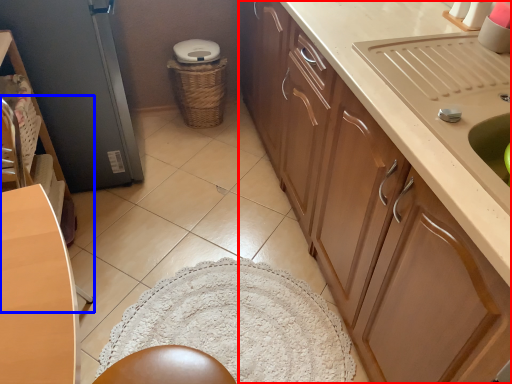
Question: Which object appears farthest to the camera in this image, cabinetry (highlighted by a red box) or chair (highlighted by a blue box)?

Choices:
 (A) cabinetry
 (B) chair

Answer: (B)